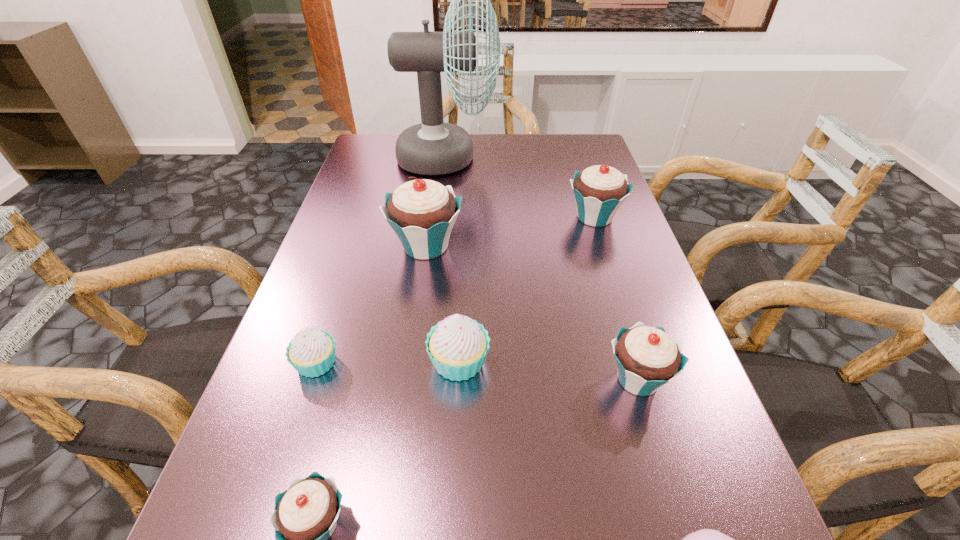
Find the location of `the farthest object`. the farthest object is located at coordinates (433, 147).

Locate an element on the screen. Image resolution: width=960 pixels, height=540 pixels. the tallest object is located at coordinates (433, 147).

Find the location of a particular element. The image size is (960, 540). the tallest cupcake is located at coordinates (422, 212).

At what (x,y) coordinates should I click in order to perform the action: click on the biggest teal cupcake. Please return your answer as a coordinate pair (x, y). This screenshot has width=960, height=540. Looking at the image, I should click on (422, 212).

Where is `the third smallest teal cupcake`? the third smallest teal cupcake is located at coordinates (599, 191).

At what (x,y) coordinates should I click in order to perform the action: click on the second tallest cupcake. Please return your answer as a coordinate pair (x, y). This screenshot has height=540, width=960. Looking at the image, I should click on (599, 191).

Locate an element on the screen. Image resolution: width=960 pixels, height=540 pixels. the right white cupcake is located at coordinates click(x=457, y=346).

At what (x,y) coordinates should I click in order to perform the action: click on the third farthest teal cupcake. Please return your answer as a coordinate pair (x, y). This screenshot has width=960, height=540. Looking at the image, I should click on (647, 358).

The image size is (960, 540). I want to click on the left white cupcake, so click(311, 352).

Locate an element on the screen. The width and height of the screenshot is (960, 540). free space located in front of the fan where the airflow is directed is located at coordinates (577, 158).